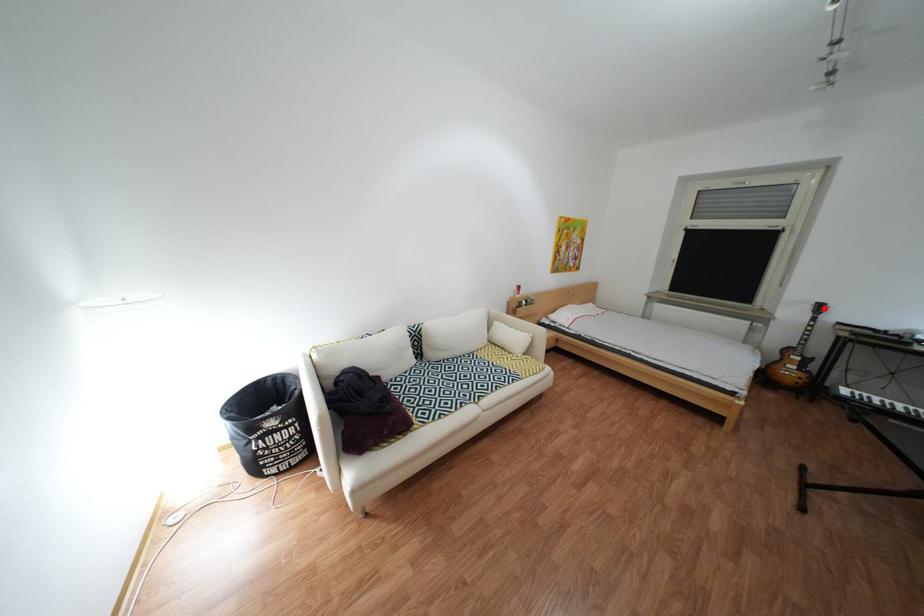
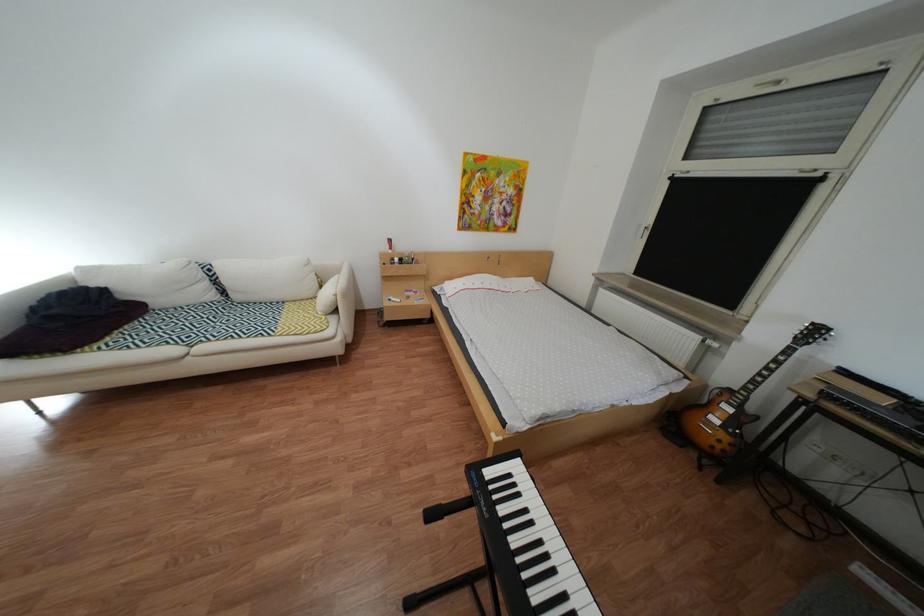
Where in the second image is the point corresponding to the highlighted location from the first image?

(810, 330)